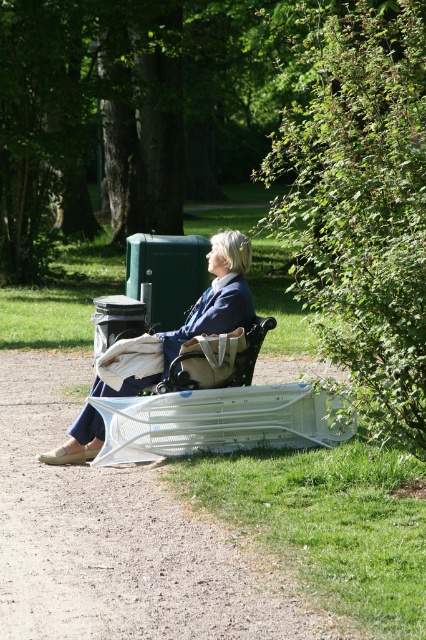
Question: Considering the relative positions of white plastic bench at lower center and wooden textured chair at center in the image provided, where is white plastic bench at lower center located with respect to wooden textured chair at center?

Choices:
 (A) left
 (B) right

Answer: (A)

Question: Which object is farther from the camera taking this photo?

Choices:
 (A) matte blue jacket at center
 (B) white plastic bench at lower center
 (C) green leafy bush at right
 (D) wooden textured chair at center

Answer: (A)

Question: Estimate the real-world distances between objects in this image. Which object is farther from the green leafy bush at right?

Choices:
 (A) wooden textured chair at center
 (B) white plastic bench at lower center

Answer: (B)

Question: Which point appears closest to the camera in this image?

Choices:
 (A) (206, 328)
 (B) (181, 532)

Answer: (B)

Question: Can you confirm if white plastic bench at lower center is positioned below wooden textured chair at center?

Choices:
 (A) yes
 (B) no

Answer: (A)

Question: Can you confirm if green leafy bush at right is smaller than wooden textured chair at center?

Choices:
 (A) no
 (B) yes

Answer: (A)